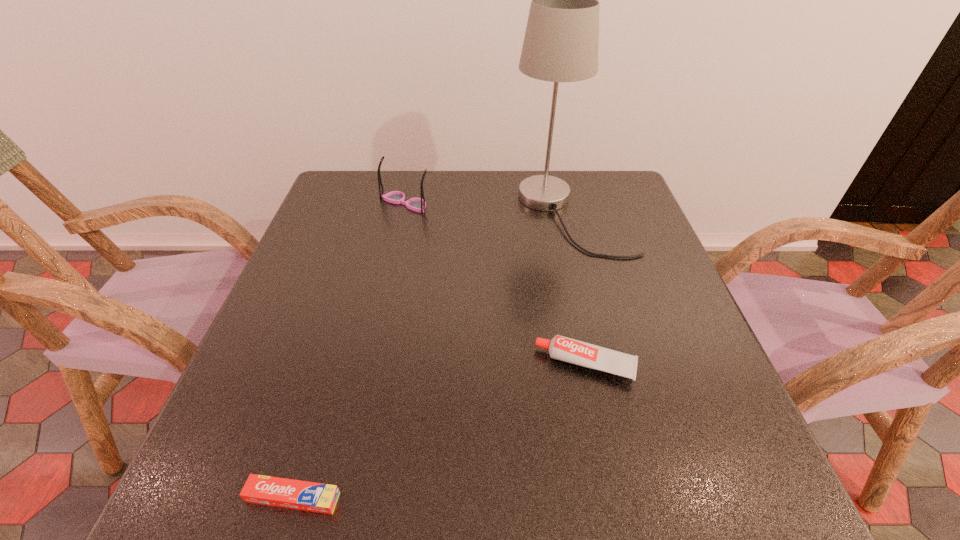
In the image, there is a desktop. Where is `free space at the far edge`? This screenshot has height=540, width=960. free space at the far edge is located at coordinates (482, 193).

Identify the location of vacant space at the near edge of the desktop. Image resolution: width=960 pixels, height=540 pixels. (387, 469).

Where is `vacant space at the left edge`? Image resolution: width=960 pixels, height=540 pixels. vacant space at the left edge is located at coordinates (233, 404).

Find the location of a particular element. vacant space at the right edge of the desktop is located at coordinates (605, 286).

Locate an element on the screen. vacant region at the far left corner of the desktop is located at coordinates (386, 181).

Find the location of `free space between the taller toothpaste and the second tallest object`. free space between the taller toothpaste and the second tallest object is located at coordinates (495, 284).

Locate an element on the screen. The image size is (960, 540). vacant area that lies between the third shortest object and the table lamp is located at coordinates tap(488, 210).

Image resolution: width=960 pixels, height=540 pixels. I want to click on free spot between the tallest object and the nearest object, so click(432, 356).

The height and width of the screenshot is (540, 960). I want to click on vacant region between the spectacles and the third farthest object, so click(495, 284).

Find the location of a particular element. The image size is (960, 540). free space between the second nearest object and the tallest object is located at coordinates (578, 290).